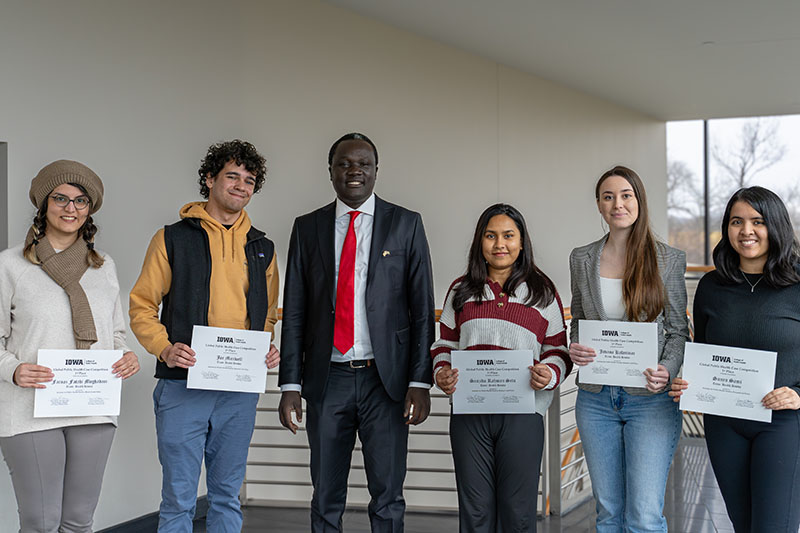
What are the coordinates of `ceiling` in the screenshot? It's located at (633, 46).